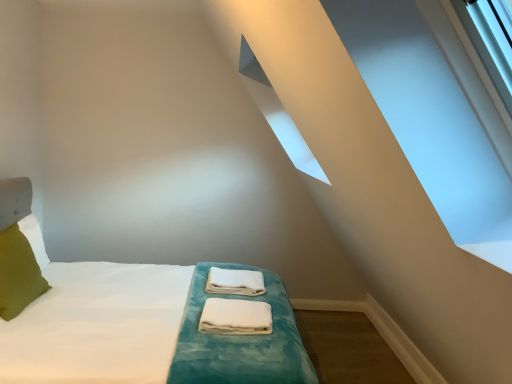
Question: Relative to green fabric pillow at left, is white fabric towels at center, which ranks as the 1th material in back-to-front order, in front or behind?

Choices:
 (A) front
 (B) behind

Answer: (B)

Question: Based on their sizes in the image, would you say white fabric towels at center, which ranks as the 1th material in back-to-front order, is bigger or smaller than green fabric pillow at left?

Choices:
 (A) small
 (B) big

Answer: (A)

Question: Based on their relative distances, which object is farther from the white soft bed at center?

Choices:
 (A) green fabric pillow at left
 (B) white fabric towels at center, marked as the 2th material in a front-to-back arrangement
 (C) white cotton towels at center, which is the second material from back to front

Answer: (B)

Question: Which object is the farthest from the white fabric towels at center, marked as the 2th material in a front-to-back arrangement?

Choices:
 (A) white cotton towels at center, marked as the first material in a front-to-back arrangement
 (B) green fabric pillow at left
 (C) white soft bed at center

Answer: (B)